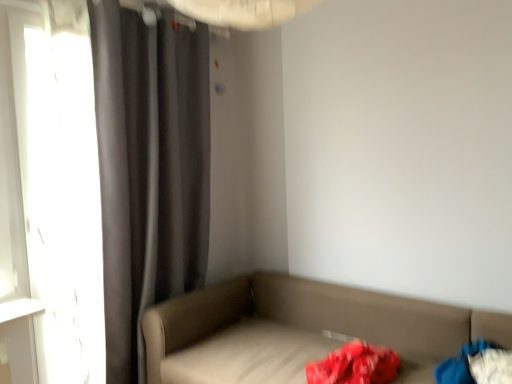
Question: Is transparent glass window at left beside leatherette studio couch at lower right?

Choices:
 (A) yes
 (B) no

Answer: (B)

Question: Does transparent glass window at left have a lesser height compared to leatherette studio couch at lower right?

Choices:
 (A) yes
 (B) no

Answer: (B)

Question: Does transparent glass window at left have a larger size compared to leatherette studio couch at lower right?

Choices:
 (A) no
 (B) yes

Answer: (A)

Question: From the image's perspective, does transparent glass window at left appear lower than leatherette studio couch at lower right?

Choices:
 (A) no
 (B) yes

Answer: (A)

Question: Does transparent glass window at left turn towards leatherette studio couch at lower right?

Choices:
 (A) no
 (B) yes

Answer: (B)

Question: From the image's perspective, is transparent glass window at left on top of leatherette studio couch at lower right?

Choices:
 (A) yes
 (B) no

Answer: (A)

Question: Is dark gray fabric curtain at left further to the viewer compared to transparent glass window at left?

Choices:
 (A) no
 (B) yes

Answer: (A)

Question: Are dark gray fabric curtain at left and transparent glass window at left beside each other?

Choices:
 (A) no
 (B) yes

Answer: (A)

Question: Does dark gray fabric curtain at left have a lesser height compared to transparent glass window at left?

Choices:
 (A) no
 (B) yes

Answer: (A)

Question: Is dark gray fabric curtain at left bigger than transparent glass window at left?

Choices:
 (A) yes
 (B) no

Answer: (A)

Question: From the image's perspective, would you say dark gray fabric curtain at left is shown under transparent glass window at left?

Choices:
 (A) no
 (B) yes

Answer: (A)

Question: Is dark gray fabric curtain at left located outside transparent glass window at left?

Choices:
 (A) no
 (B) yes

Answer: (B)

Question: Is dark gray fabric curtain at left shorter than blue fabric bag at lower right?

Choices:
 (A) yes
 (B) no

Answer: (B)